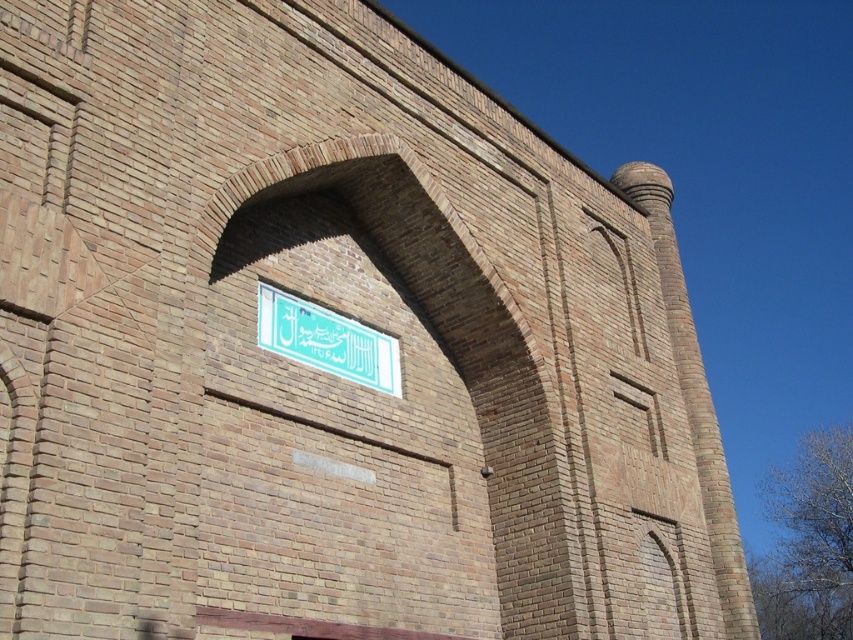
Question: Is brown brick archway at center to the right of white glossy sign at center from the viewer's perspective?

Choices:
 (A) no
 (B) yes

Answer: (B)

Question: Among these points, which one is nearest to the camera?

Choices:
 (A) (508, 445)
 (B) (343, 368)

Answer: (B)

Question: Can you confirm if brown brick archway at center is positioned to the right of white glossy sign at center?

Choices:
 (A) no
 (B) yes

Answer: (B)

Question: Does brown brick archway at center appear under white glossy sign at center?

Choices:
 (A) yes
 (B) no

Answer: (A)

Question: Which point is closer to the camera?

Choices:
 (A) brown brick archway at center
 (B) white glossy sign at center

Answer: (A)